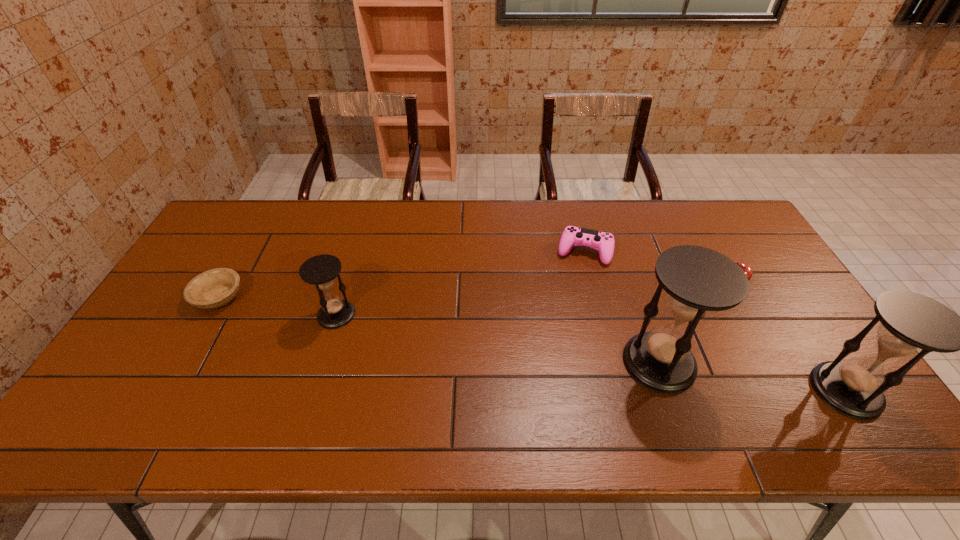
Find the location of a particular element. The width and height of the screenshot is (960, 540). vacant area that lies between the second hourglass from right to left and the second tallest object is located at coordinates point(753,376).

At what (x,y) coordinates should I click in order to perform the action: click on blank region between the farthest object and the second hourglass from right to left. Please return your answer as a coordinate pair (x, y). Looking at the image, I should click on (622, 307).

Where is `free spot between the shortest hourglass and the apple`? free spot between the shortest hourglass and the apple is located at coordinates (533, 301).

Locate an element on the screen. object that is the second closest to the farthest object is located at coordinates (746, 268).

Locate which object ranks in proximity to the bowl. Please provide its 2D coordinates. Your answer should be formatted as a tuple, i.e. [(x, y)], where the tuple contains the x and y coordinates of a point satisfying the conditions above.

[(321, 270)]

Select which hourglass appears as the closest to the second hourglass from left to right. Please provide its 2D coordinates. Your answer should be formatted as a tuple, i.e. [(x, y)], where the tuple contains the x and y coordinates of a point satisfying the conditions above.

[(912, 324)]

The image size is (960, 540). I want to click on hourglass that is the closest to the farthest hourglass, so click(x=697, y=280).